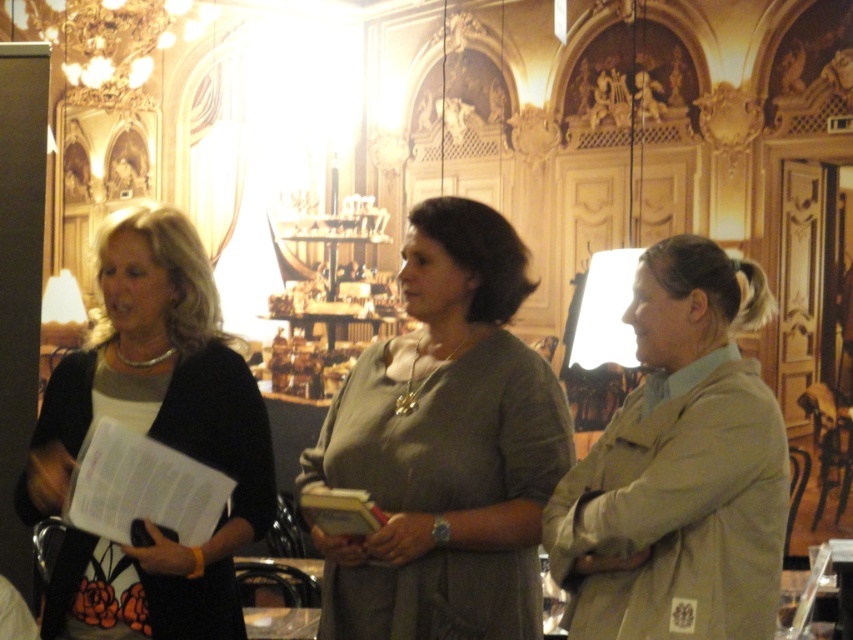
Question: Can you confirm if matte olive green blouse at center is positioned below tan fabric jacket at right?

Choices:
 (A) yes
 (B) no

Answer: (B)

Question: Estimate the real-world distances between objects in this image. Which object is closer to the tan fabric jacket at right?

Choices:
 (A) matte olive green blouse at center
 (B) matte black sweater at left

Answer: (A)

Question: Estimate the real-world distances between objects in this image. Which object is farther from the matte olive green blouse at center?

Choices:
 (A) tan fabric jacket at right
 (B) matte black sweater at left

Answer: (B)

Question: Among these objects, which one is nearest to the camera?

Choices:
 (A) matte black sweater at left
 (B) matte olive green blouse at center
 (C) tan fabric jacket at right

Answer: (C)

Question: Is tan fabric jacket at right further to camera compared to matte black sweater at left?

Choices:
 (A) no
 (B) yes

Answer: (A)

Question: Can you confirm if matte olive green blouse at center is positioned below tan fabric jacket at right?

Choices:
 (A) no
 (B) yes

Answer: (A)